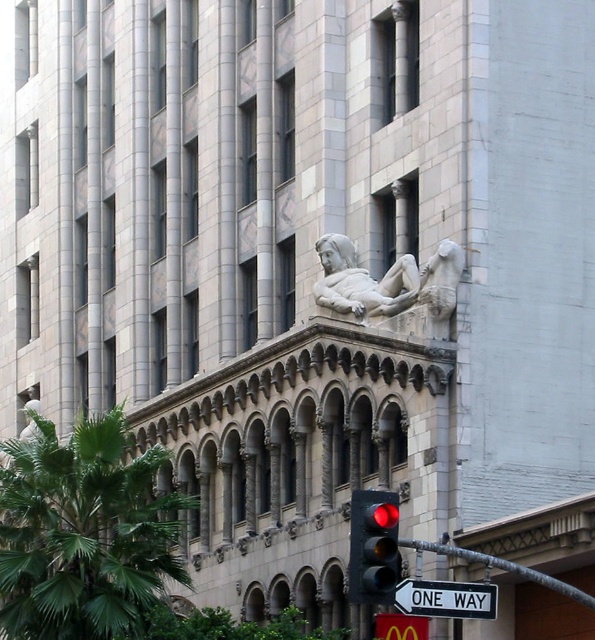
Can you confirm if green leafy palm tree at center is shorter than white plastic sign at lower right?

In fact, green leafy palm tree at center may be taller than white plastic sign at lower right.

Who is taller, green leafy palm tree at center or white plastic sign at lower right?

green leafy palm tree at center

Who is more distant from viewer, (18,540) or (421,579)?

Point (18,540)

Locate an element on the screen. The width and height of the screenshot is (595, 640). green leafy palm tree at center is located at coordinates pyautogui.click(x=83, y=532).

Consider the image. Which of these two, stone statue at center or white plastic sign at lower right, stands taller?

white plastic sign at lower right is taller.

Is point (340, 304) closer to camera compared to point (434, 596)?

No.

Who is more forward, [322,246] or [464,586]?

Point [464,586] is in front.

Where is `stone statue at center`? stone statue at center is located at coordinates pos(361,282).

Does white plastic sign at lower right appear on the right side of black plastic traffic sign at lower right?

Incorrect, white plastic sign at lower right is not on the right side of black plastic traffic sign at lower right.

Is white plastic sign at lower right below black plastic traffic sign at lower right?

Incorrect, white plastic sign at lower right is not positioned below black plastic traffic sign at lower right.

Which is in front, point (439, 609) or point (402, 636)?

Point (439, 609) is in front.

This screenshot has width=595, height=640. Find the location of `white plastic sign at lower right`. white plastic sign at lower right is located at coordinates (446, 598).